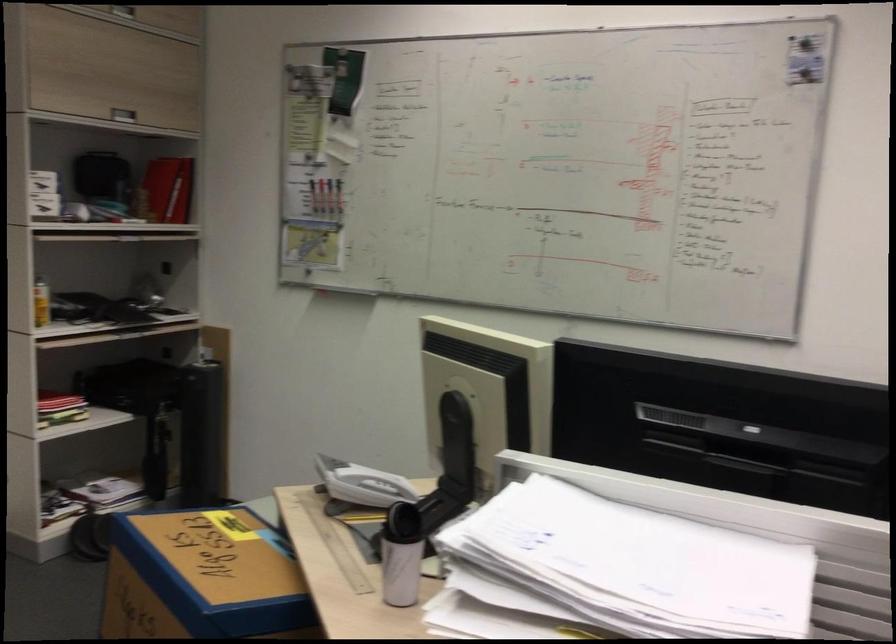
Image resolution: width=896 pixels, height=644 pixels. Describe the element at coordinates (457, 453) in the screenshot. I see `a phone handset` at that location.